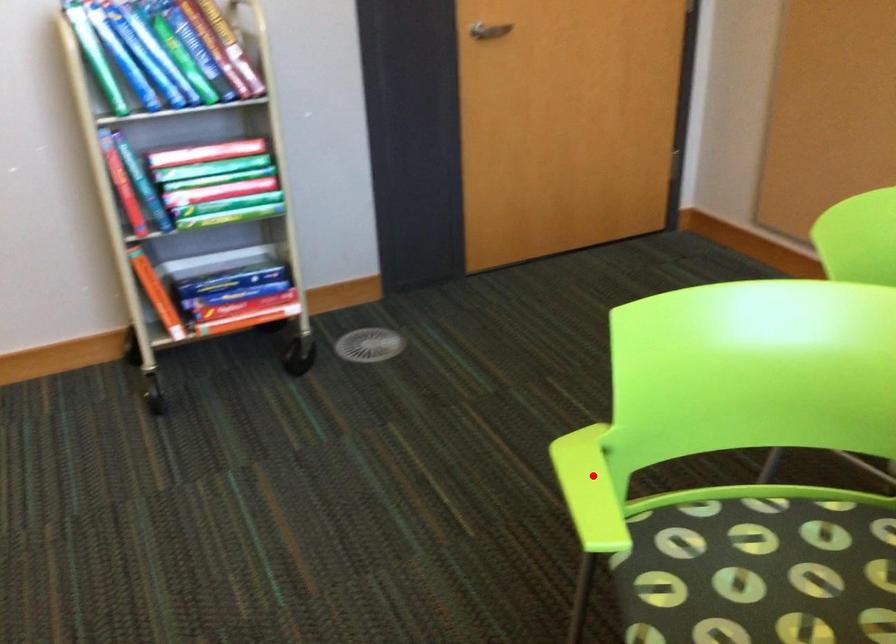
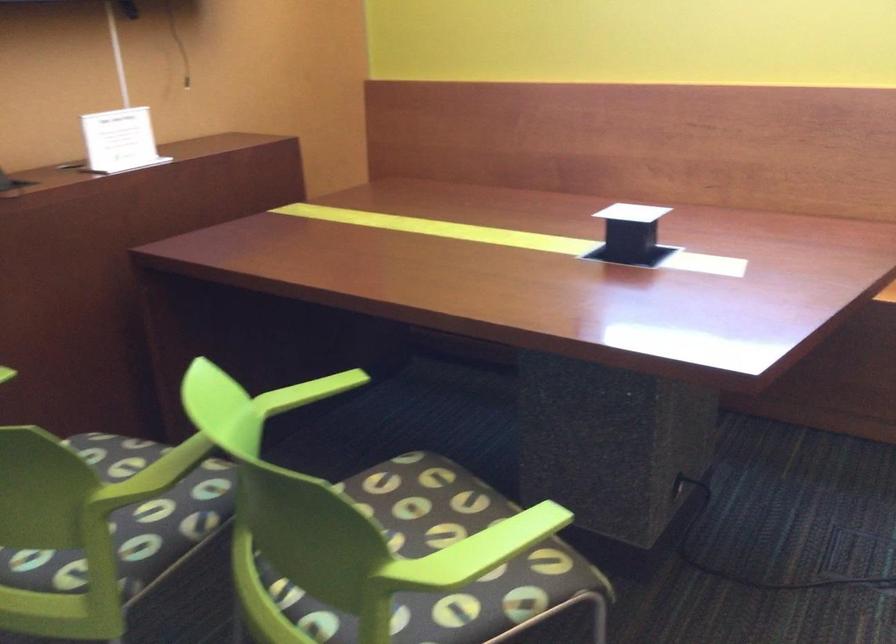
Where in the second image is the point corresponding to the highlighted location from the first image?

(476, 552)